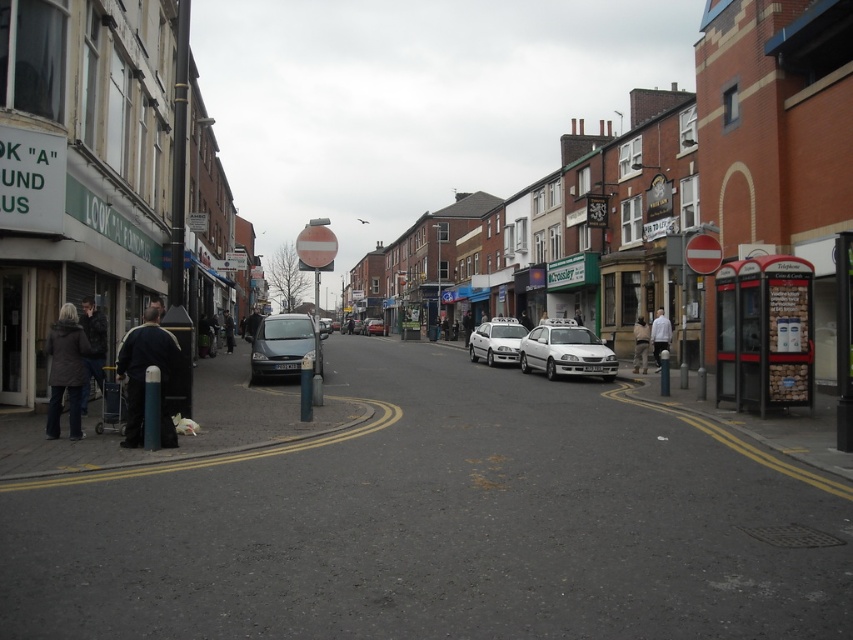
You are a delivery person standing at the point marked by coordinates (93, 348) in the image. You need to place a brown leather jacket at lower left. Is the jacket already present at that location?

Yes, the brown leather jacket at lower left is already present at the point marked by coordinates (93, 348).

You are a pedestrian standing on the sidewalk of the street scene. You see a white matte shirt at center and a dark blue jacket at center. Which clothing item is closer to you?

The white matte shirt at center is closer to you because it is in front of the dark blue jacket at center.

In the scene shown: You are a delivery person trying to navigate through the street scene. You need to place a large package between the brown leather jacket at lower left and the matte silver car at center. Considering their sizes, which object should you position the package closer to?

The brown leather jacket at lower left occupies less space than the matte silver car at center, so you should position the package closer to the matte silver car at center to ensure there is enough space.